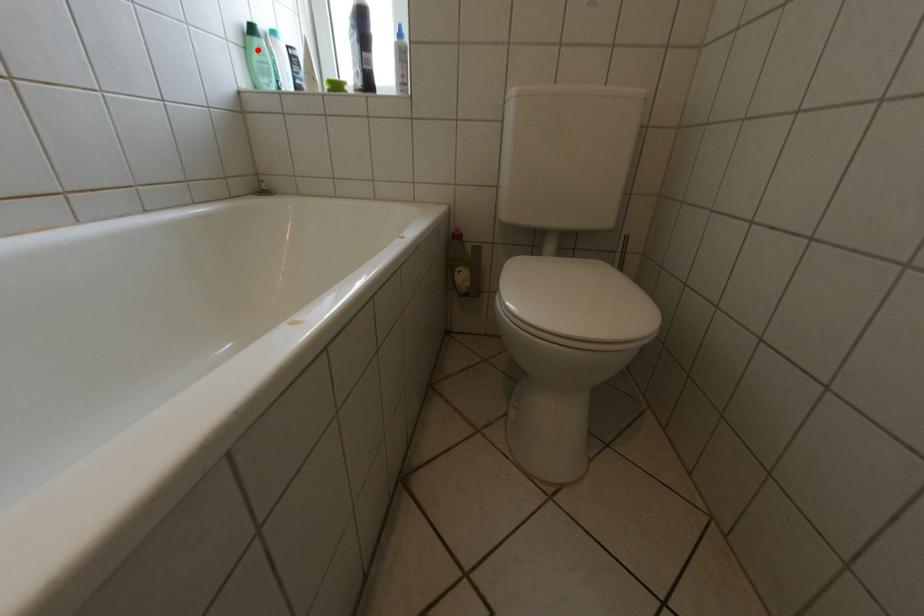
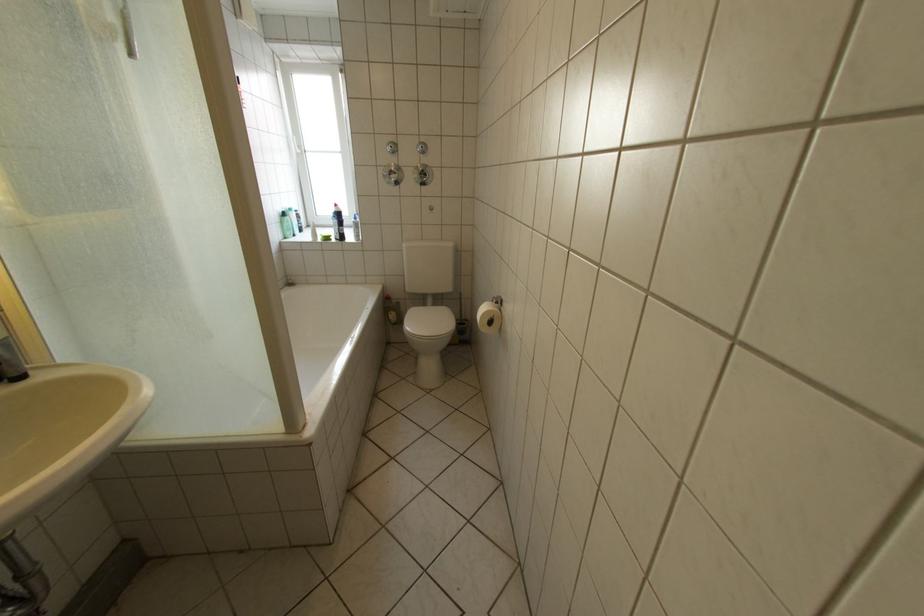
The point at the highlighted location is marked in the first image. Where is the corresponding point in the second image?

(294, 224)